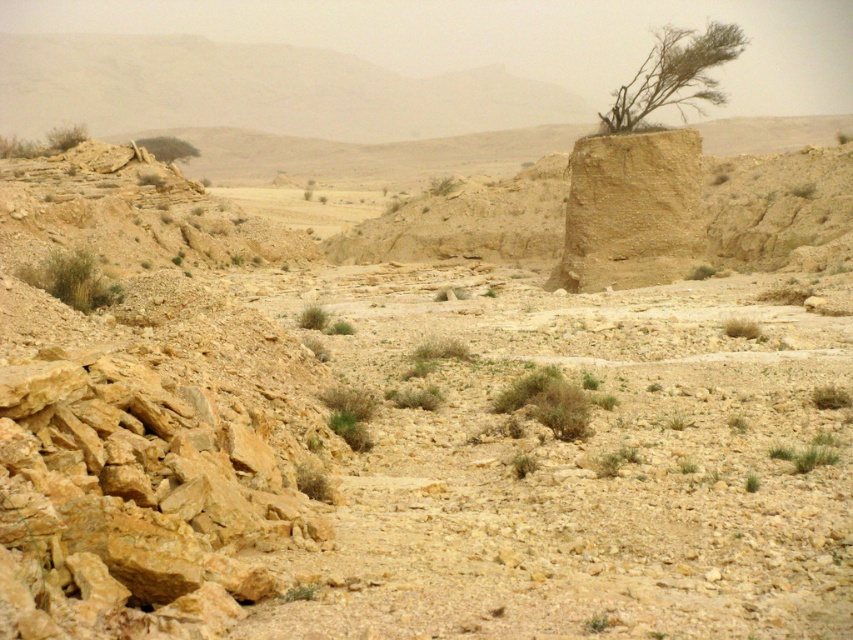
Can you confirm if rusty stone boulder at lower left is taller than green grassy bush at lower left?

In fact, rusty stone boulder at lower left may be shorter than green grassy bush at lower left.

Does rusty stone boulder at lower left appear over green grassy bush at lower left?

No, rusty stone boulder at lower left is not above green grassy bush at lower left.

Is point (189, 560) closer to viewer compared to point (109, 291)?

That is True.

At what (x,y) coordinates should I click in order to perform the action: click on rusty stone boulder at lower left. Please return your answer as a coordinate pair (x, y). Image resolution: width=853 pixels, height=640 pixels. Looking at the image, I should click on (134, 502).

Which is more to the left, brown clay rock at center or green grassy bush at lower left?

From the viewer's perspective, green grassy bush at lower left appears more on the left side.

Can you confirm if brown clay rock at center is positioned below green grassy bush at lower left?

Incorrect, brown clay rock at center is not positioned below green grassy bush at lower left.

The image size is (853, 640). I want to click on brown clay rock at center, so (631, 211).

Does rusty stone boulder at lower left appear under green leafy bush at center?

Indeed, rusty stone boulder at lower left is positioned under green leafy bush at center.

Who is higher up, rusty stone boulder at lower left or green leafy bush at center?

green leafy bush at center is above.

The height and width of the screenshot is (640, 853). What do you see at coordinates (134, 502) in the screenshot?
I see `rusty stone boulder at lower left` at bounding box center [134, 502].

What are the coordinates of `rusty stone boulder at lower left` in the screenshot? It's located at (134, 502).